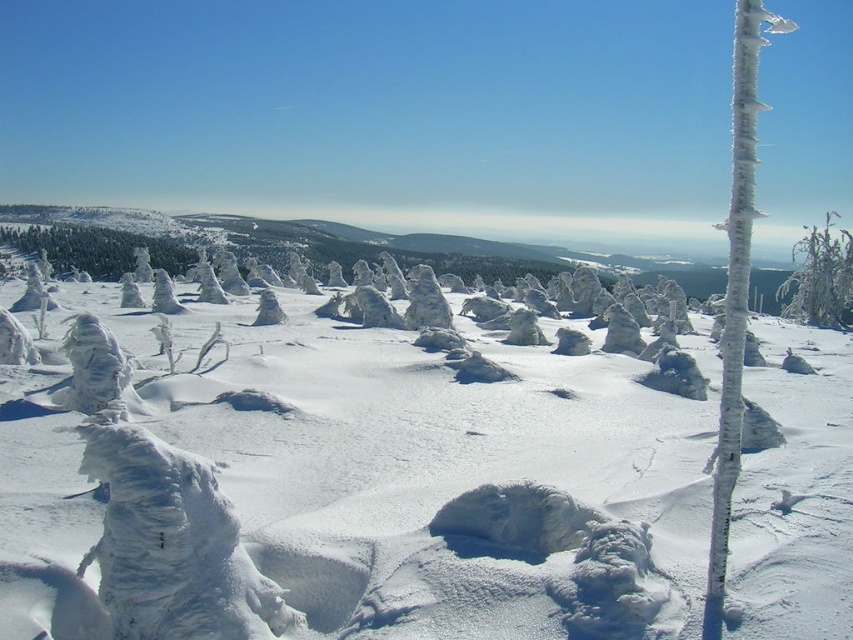
Can you confirm if icy white pole at right is thinner than icy white tree at right?

Indeed, icy white pole at right has a lesser width compared to icy white tree at right.

Who is higher up, icy white pole at right or icy white tree at right?

icy white tree at right is higher up.

Is point (752, 209) closer to viewer compared to point (849, 259)?

Yes, point (752, 209) is in front of point (849, 259).

This screenshot has height=640, width=853. Find the location of `icy white pole at right`. icy white pole at right is located at coordinates (735, 288).

Can you confirm if white frosty trees at center is wider than icy white tree at right?

Incorrect, white frosty trees at center's width does not surpass icy white tree at right's.

Is point (280, 508) in front of point (838, 317)?

Yes, point (280, 508) is in front of point (838, 317).

Where is `white frosty trees at center`? The image size is (853, 640). white frosty trees at center is located at coordinates (347, 492).

Does white frosty trees at center appear on the left side of icy white pole at right?

Correct, you'll find white frosty trees at center to the left of icy white pole at right.

Is point (303, 596) behind point (732, 273)?

Yes, it is behind point (732, 273).

Is point (776, 404) in front of point (741, 198)?

That is False.

Image resolution: width=853 pixels, height=640 pixels. What are the coordinates of `white frosty trees at center` in the screenshot? It's located at (347, 492).